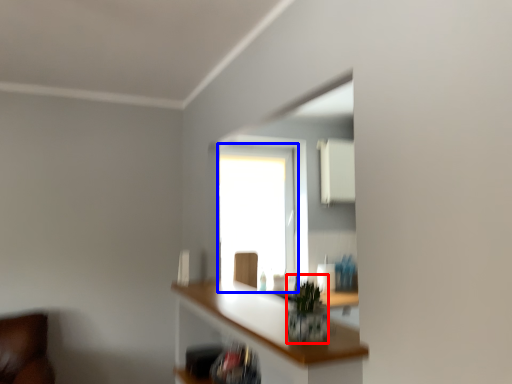
Question: Which object appears farthest to the camera in this image, plant (highlighted by a red box) or window (highlighted by a blue box)?

Choices:
 (A) plant
 (B) window

Answer: (B)